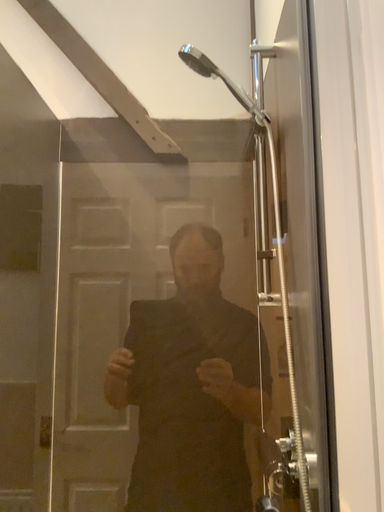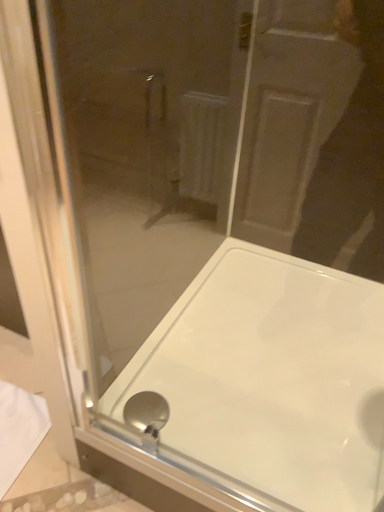
Question: How did the camera likely rotate when shooting the video?

Choices:
 (A) rotated upward
 (B) rotated downward

Answer: (B)